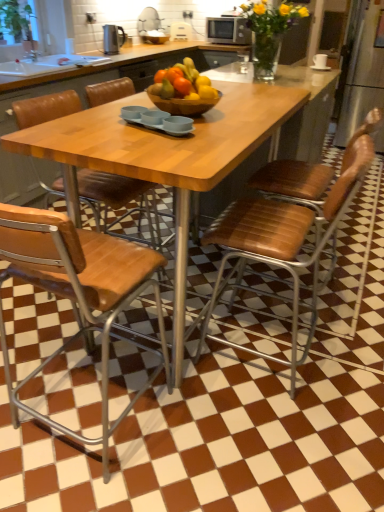
The image size is (384, 512). I want to click on vacant space underneath brown leather chair at center, acting as the third chair starting from the left (from a real-world perspective), so click(x=267, y=358).